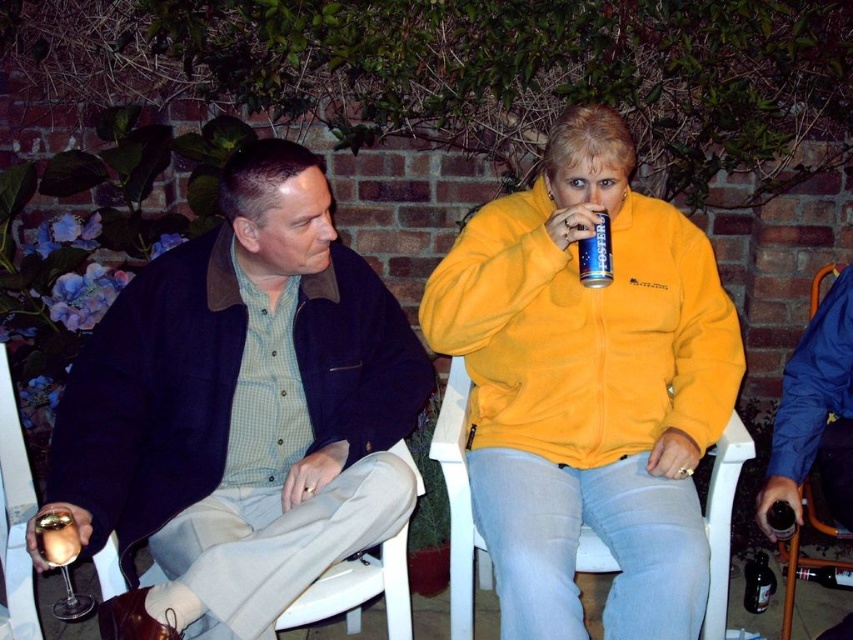
The width and height of the screenshot is (853, 640). What do you see at coordinates (56, 536) in the screenshot?
I see `metallic gold ring at lower left` at bounding box center [56, 536].

Is point (67, 516) in front of point (583, 241)?

Yes, it is in front of point (583, 241).

Image resolution: width=853 pixels, height=640 pixels. In order to click on metallic gold ring at lower left in this screenshot , I will do `click(56, 536)`.

Does matte blue jacket at center lie in front of blue metallic can at upper center?

Yes, it is.

Does matte blue jacket at center have a smaller size compared to blue metallic can at upper center?

Incorrect, matte blue jacket at center is not smaller in size than blue metallic can at upper center.

Is point (68, 410) in front of point (607, 221)?

Yes, it is in front of point (607, 221).

What are the coordinates of `matte blue jacket at center` in the screenshot? It's located at (242, 410).

Which is more to the left, matte blue jacket at center or white plastic chair at lower center?

matte blue jacket at center is more to the left.

Is matte blue jacket at center above white plastic chair at lower center?

Yes.

Based on the photo, who is more forward, (293, 317) or (263, 556)?

Point (263, 556) is more forward.

The width and height of the screenshot is (853, 640). Identify the location of matte blue jacket at center. (242, 410).